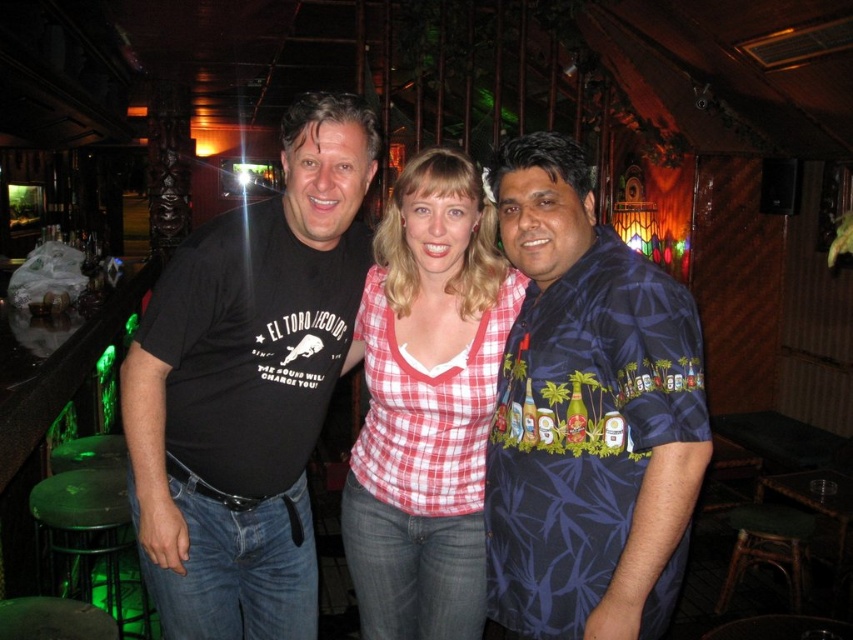
Does black t-shirt at center appear over rattan stool at lower right?

Yes, black t-shirt at center is above rattan stool at lower right.

Is black t-shirt at center to the right of rattan stool at lower right from the viewer's perspective?

In fact, black t-shirt at center is to the left of rattan stool at lower right.

Describe the element at coordinates (248, 387) in the screenshot. I see `black t-shirt at center` at that location.

The width and height of the screenshot is (853, 640). What are the coordinates of `black t-shirt at center` in the screenshot? It's located at (248, 387).

Is black t-shirt at center positioned before red checkered shirt at center?

Yes.

Which is behind, point (297, 516) or point (489, 211)?

Point (297, 516)

What are the coordinates of `black t-shirt at center` in the screenshot? It's located at (248, 387).

Does blue satin shirt at right appear on the right side of red checkered shirt at center?

Indeed, blue satin shirt at right is positioned on the right side of red checkered shirt at center.

Can you confirm if blue satin shirt at right is positioned to the left of red checkered shirt at center?

No, blue satin shirt at right is not to the left of red checkered shirt at center.

Does point (538, 388) come farther from viewer compared to point (450, 509)?

No.

I want to click on blue satin shirt at right, so click(x=589, y=417).